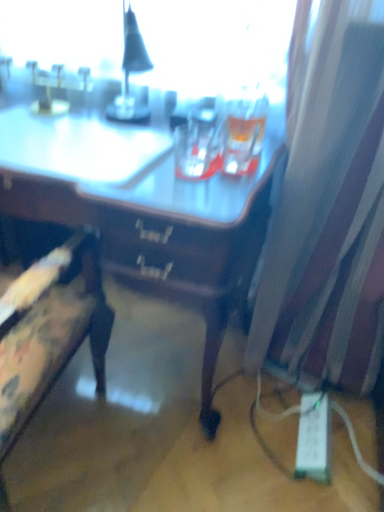
Question: Looking at the image, does wooden desk at center seem bigger or smaller compared to floral fabric chair at left?

Choices:
 (A) big
 (B) small

Answer: (A)

Question: From their relative heights in the image, would you say wooden desk at center is taller or shorter than floral fabric chair at left?

Choices:
 (A) short
 (B) tall

Answer: (A)

Question: Based on their relative distances, which object is nearer to the white sheer curtain at right?

Choices:
 (A) wooden desk at center
 (B) white plastic extension cord at lower right
 (C) floral fabric chair at left

Answer: (A)

Question: Which object is positioned closest to the wooden desk at center?

Choices:
 (A) white plastic extension cord at lower right
 (B) white sheer curtain at right
 (C) floral fabric chair at left

Answer: (C)